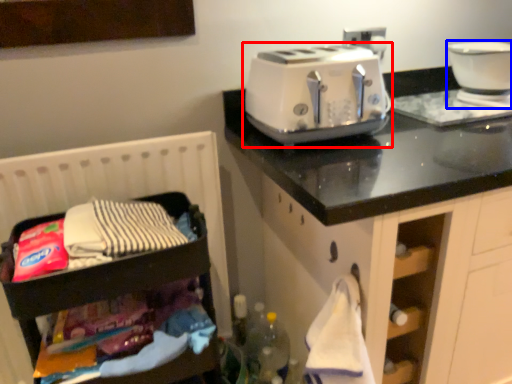
Question: Which of the following is the farthest to the observer, toaster (highlighted by a red box) or home appliance (highlighted by a blue box)?

Choices:
 (A) toaster
 (B) home appliance

Answer: (B)